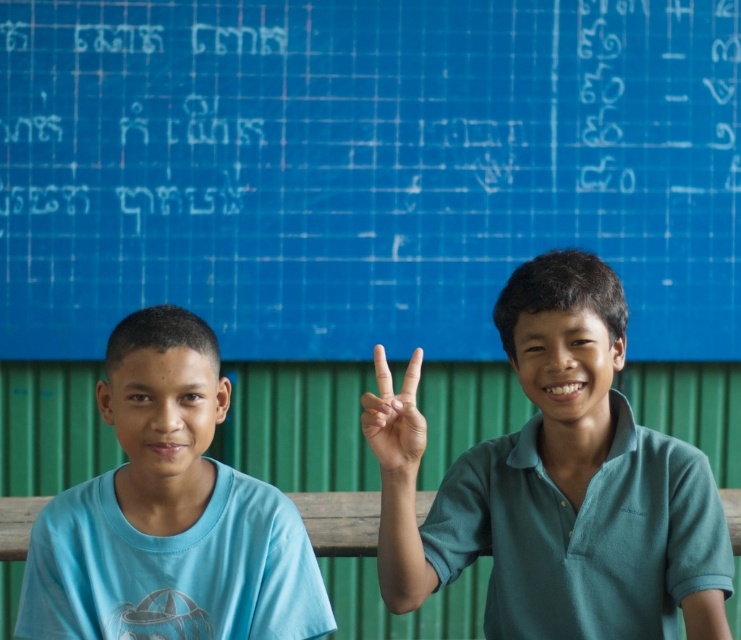
You are a photographer trying to capture the boy in the blue cotton shirt at left. Based on their positions, which direction should you move the camera to focus on him more?

Since the blue cotton shirt at left is located at point (x=169, y=515), you should move the camera to the right to focus on him more.